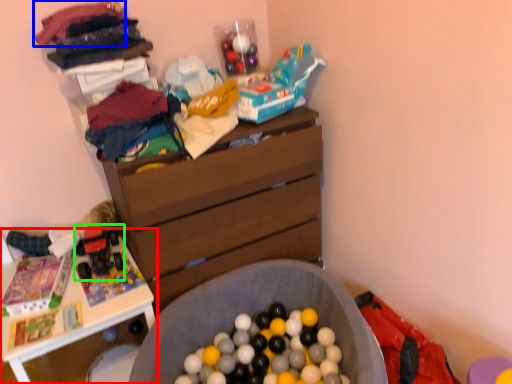
Question: Which is nearer to the table (highlighted by a red box)? clothing (highlighted by a blue box) or toy car (highlighted by a green box).

Choices:
 (A) clothing
 (B) toy car

Answer: (B)